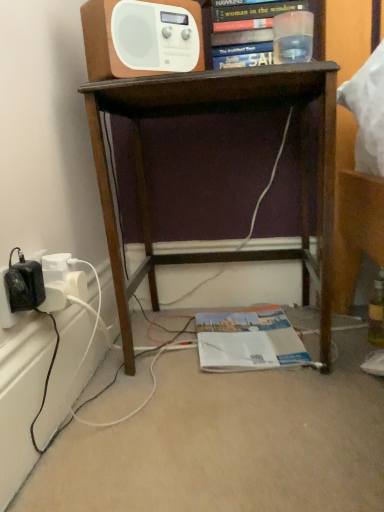
The width and height of the screenshot is (384, 512). What do you see at coordinates (212, 110) in the screenshot?
I see `brown wood desk at center` at bounding box center [212, 110].

Describe the element at coordinates (248, 34) in the screenshot. I see `hardcover book at upper center` at that location.

Locate an element on the screen. The height and width of the screenshot is (512, 384). hardcover book at upper center is located at coordinates (248, 34).

Find the location of a particular element. brown wood desk at center is located at coordinates [212, 110].

Considering the sizes of objects hardcover book at upper center and brown wood desk at center in the image provided, who is thinner, hardcover book at upper center or brown wood desk at center?

With smaller width is hardcover book at upper center.

How many degrees apart are the facing directions of hardcover book at upper center and brown wood desk at center?

There is a 0.00101-degree angle between the facing directions of hardcover book at upper center and brown wood desk at center.

Which is more to the right, hardcover book at upper center or brown wood desk at center?

Positioned to the right is hardcover book at upper center.

From the image's perspective, is hardcover book at upper center on brown wood desk at center?

Yes.

Considering the positions of points (88, 22) and (305, 176), is point (88, 22) closer to camera compared to point (305, 176)?

Yes, it is.

From the image's perspective, which is below, white plastic radio at upper center or brown wood desk at center?

brown wood desk at center appears lower in the image.

What's the angular difference between white plastic radio at upper center and brown wood desk at center's facing directions?

They differ by 42.3 degrees in their facing directions.

At what (x,y) coordinates should I click in order to perform the action: click on shelf on the left of brown wood desk at center. Please return your answer as a coordinate pair (x, y). Looking at the image, I should click on (104, 44).

Looking at the image, does brown wood desk at center seem bigger or smaller compared to hardcover book at upper center?

Clearly, brown wood desk at center is larger in size than hardcover book at upper center.

Are brown wood desk at center and hardcover book at upper center beside each other?

brown wood desk at center and hardcover book at upper center are clearly separated.

Which is more to the left, brown wood desk at center or hardcover book at upper center?

Positioned to the left is brown wood desk at center.

You are a GUI agent. You are given a task and a screenshot of the screen. Output one action in this format:
    pyautogui.click(x=<x>, y=<y>)
    Task: Click on the book positioned vertically above the brown wood desk at center (from a real-world perspective)
    Image resolution: width=384 pixels, height=512 pixels.
    Given the screenshot: What is the action you would take?
    pyautogui.click(x=248, y=34)

From the image's perspective, which one is positioned lower, white plastic radio at upper center or white glossy magazine at lower center?

white glossy magazine at lower center.

In the scene shown: Are white plastic radio at upper center and white glossy magazine at lower center beside each other?

No.

At what (x,y) coordinates should I click in order to perform the action: click on shelf above the white glossy magazine at lower center (from the image's perspective). Please return your answer as a coordinate pair (x, y). The width and height of the screenshot is (384, 512). Looking at the image, I should click on (104, 44).

Considering the positions of point (200, 25) and point (219, 362), is point (200, 25) closer or farther from the camera than point (219, 362)?

Clearly, point (200, 25) is more distant from the camera than point (219, 362).

Based on the photo, which of these two, white glossy magazine at lower center or brown wood desk at center, stands shorter?

With less height is white glossy magazine at lower center.

Would you say white glossy magazine at lower center contains brown wood desk at center?

No, brown wood desk at center is not a part of white glossy magazine at lower center.

Considering the sizes of white glossy magazine at lower center and brown wood desk at center in the image, is white glossy magazine at lower center wider or thinner than brown wood desk at center?

Clearly, white glossy magazine at lower center has less width compared to brown wood desk at center.

Is white glossy magazine at lower center positioned with its back to brown wood desk at center?

Yes.

Which object is thinner, hardcover book at upper center or white glossy magazine at lower center?

Thinner between the two is hardcover book at upper center.

From a real-world perspective, which is physically below, hardcover book at upper center or white glossy magazine at lower center?

white glossy magazine at lower center, from a real-world perspective.

Is hardcover book at upper center to the left of white glossy magazine at lower center from the viewer's perspective?

No, hardcover book at upper center is not to the left of white glossy magazine at lower center.

Based on the photo, can you confirm if hardcover book at upper center is shorter than white glossy magazine at lower center?

Incorrect, the height of hardcover book at upper center does not fall short of that of white glossy magazine at lower center.

Find the location of a particular element. The width and height of the screenshot is (384, 512). desk beneath the white plastic radio at upper center (from a real-world perspective) is located at coordinates (212, 110).

Is brown wood desk at center positioned with its back to white plastic radio at upper center?

That's not correct — brown wood desk at center is not looking away from white plastic radio at upper center.

Consider the image. From the image's perspective, who appears lower, brown wood desk at center or white plastic radio at upper center?

brown wood desk at center appears lower in the image.

How different are the orientations of brown wood desk at center and white plastic radio at upper center in degrees?

They differ by 42.3 degrees in their facing directions.

You are a GUI agent. You are given a task and a screenshot of the screen. Output one action in this format:
    pyautogui.click(x=<x>, y=<y>)
    Task: Click on the book lying behind the brown wood desk at center
    This screenshot has height=512, width=384.
    Given the screenshot: What is the action you would take?
    (248, 34)

Locate an element on the screen. Image resolution: width=384 pixels, height=512 pixels. desk below the white plastic radio at upper center (from a real-world perspective) is located at coordinates (212, 110).

Looking at this image, looking at the image, which one is located closer to hardcover book at upper center, white glossy magazine at lower center or brown wood desk at center?

brown wood desk at center.

When comparing their distances from white plastic radio at upper center, does brown wood desk at center or white glossy magazine at lower center seem closer?

brown wood desk at center is positioned closer to the anchor white plastic radio at upper center.

Estimate the real-world distances between objects in this image. Which object is further from white glossy magazine at lower center, white plastic radio at upper center or hardcover book at upper center?

Among the two, white plastic radio at upper center is located further to white glossy magazine at lower center.

Estimate the real-world distances between objects in this image. Which object is further from brown wood desk at center, white plastic radio at upper center or hardcover book at upper center?

white plastic radio at upper center is positioned further to the anchor brown wood desk at center.

Estimate the real-world distances between objects in this image. Which object is further from white plastic radio at upper center, white glossy magazine at lower center or hardcover book at upper center?

Among the two, white glossy magazine at lower center is located further to white plastic radio at upper center.

Looking at the image, which one is located closer to hardcover book at upper center, brown wood desk at center or white plastic radio at upper center?

Based on the image, white plastic radio at upper center appears to be nearer to hardcover book at upper center.

Considering their positions, is white plastic radio at upper center positioned closer to brown wood desk at center than white glossy magazine at lower center?

white plastic radio at upper center is positioned closer to the anchor brown wood desk at center.

From the image, which object appears to be nearer to white plastic radio at upper center, hardcover book at upper center or brown wood desk at center?

hardcover book at upper center lies closer to white plastic radio at upper center than the other object.

The image size is (384, 512). What are the coordinates of `shelf between hardcover book at upper center and brown wood desk at center in the up-down direction` in the screenshot? It's located at (104, 44).

Where is `shelf between hardcover book at upper center and white glossy magazine at lower center in the vertical direction`? The height and width of the screenshot is (512, 384). shelf between hardcover book at upper center and white glossy magazine at lower center in the vertical direction is located at coordinates (104, 44).

You are a GUI agent. You are given a task and a screenshot of the screen. Output one action in this format:
    pyautogui.click(x=<x>, y=<y>)
    Task: Click on the desk between white plastic radio at upper center and white glossy magazine at lower center in the vertical direction
    
    Given the screenshot: What is the action you would take?
    pyautogui.click(x=212, y=110)

I want to click on desk between hardcover book at upper center and white glossy magazine at lower center in the up-down direction, so (x=212, y=110).